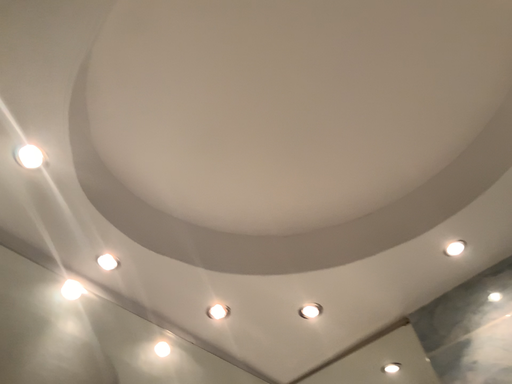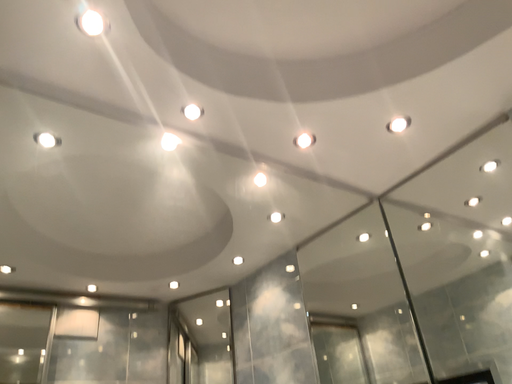
Question: How did the camera likely rotate when shooting the video?

Choices:
 (A) rotated left
 (B) rotated right

Answer: (A)